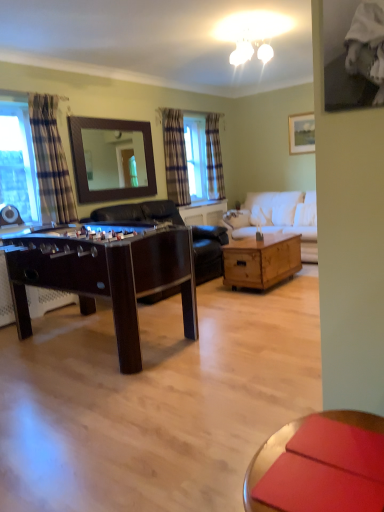
The height and width of the screenshot is (512, 384). I want to click on free spot to the right of dark wood foosball table at center, positioned as the second table in right-to-left order, so click(254, 336).